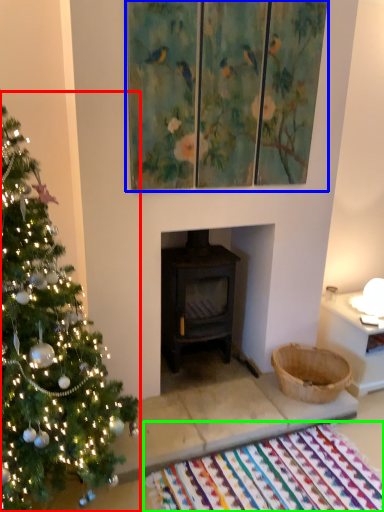
Question: Considering the real-world distances, which object is closest to christmas tree (highlighted by a red box)? picture frame (highlighted by a blue box) or mat (highlighted by a green box).

Choices:
 (A) picture frame
 (B) mat

Answer: (B)